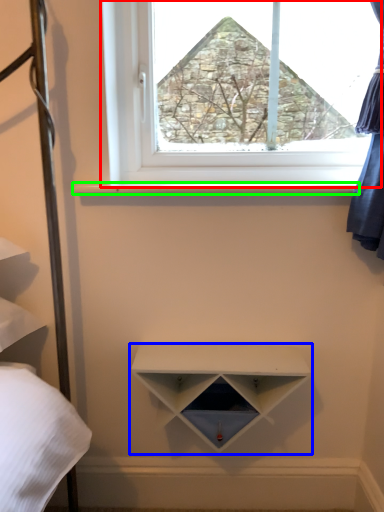
Question: Based on their relative distances, which object is farther from window (highlighted by a red box)? Choose from shelf (highlighted by a blue box) and window sill (highlighted by a green box).

Choices:
 (A) shelf
 (B) window sill

Answer: (A)